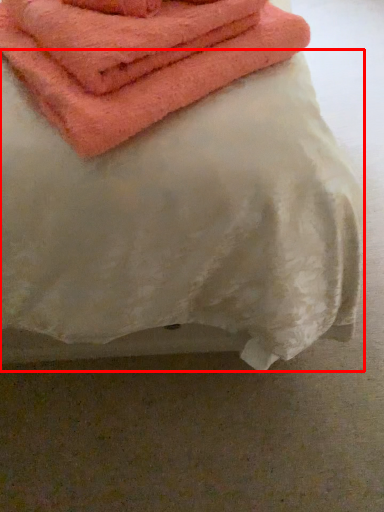
Question: Observing the image, what is the correct spatial positioning of sheet (annotated by the red box) in reference to towel?

Choices:
 (A) right
 (B) left

Answer: (B)